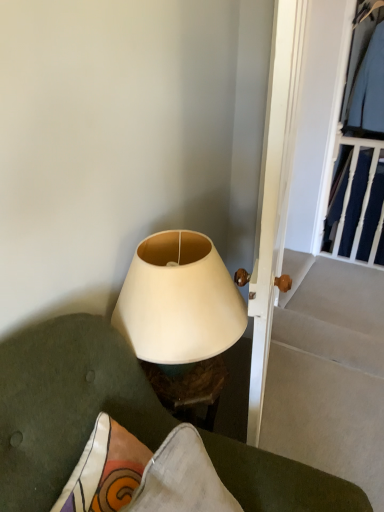
Question: Is the position of matte white lampshade at center more distant than that of white matte lampshade at center?

Choices:
 (A) no
 (B) yes

Answer: (A)

Question: Is matte white lampshade at center in front of white matte lampshade at center?

Choices:
 (A) yes
 (B) no

Answer: (A)

Question: From the image's perspective, is matte white lampshade at center beneath white matte lampshade at center?

Choices:
 (A) no
 (B) yes

Answer: (B)

Question: Is matte white lampshade at center turned away from white matte lampshade at center?

Choices:
 (A) yes
 (B) no

Answer: (B)

Question: Can you confirm if matte white lampshade at center is shorter than white matte lampshade at center?

Choices:
 (A) yes
 (B) no

Answer: (B)

Question: Are matte white lampshade at center and white matte lampshade at center making contact?

Choices:
 (A) yes
 (B) no

Answer: (B)

Question: Considering the relative sizes of light blue fabric shirt at upper right, arranged as the second clothing when ordered from the bottom, and matte white lampshade at center in the image provided, is light blue fabric shirt at upper right, arranged as the second clothing when ordered from the bottom, thinner than matte white lampshade at center?

Choices:
 (A) no
 (B) yes

Answer: (A)

Question: Does light blue fabric shirt at upper right, arranged as the second clothing when ordered from the bottom, come in front of matte white lampshade at center?

Choices:
 (A) yes
 (B) no

Answer: (B)

Question: Is light blue fabric shirt at upper right, arranged as the second clothing when ordered from the bottom, oriented away from matte white lampshade at center?

Choices:
 (A) yes
 (B) no

Answer: (B)

Question: From a real-world perspective, does light blue fabric shirt at upper right, which ranks as the 1th clothing in top-to-bottom order, stand above matte white lampshade at center?

Choices:
 (A) no
 (B) yes

Answer: (B)

Question: Is matte white lampshade at center completely or partially inside light blue fabric shirt at upper right, arranged as the second clothing when ordered from the bottom?

Choices:
 (A) yes
 (B) no

Answer: (B)

Question: Is light blue fabric shirt at upper right, arranged as the second clothing when ordered from the bottom, to the left of matte white lampshade at center from the viewer's perspective?

Choices:
 (A) yes
 (B) no

Answer: (B)

Question: Does dark blue fabric at upper right, positioned as the first clothing in bottom-to-top order, have a smaller size compared to white wooden door at center?

Choices:
 (A) yes
 (B) no

Answer: (A)